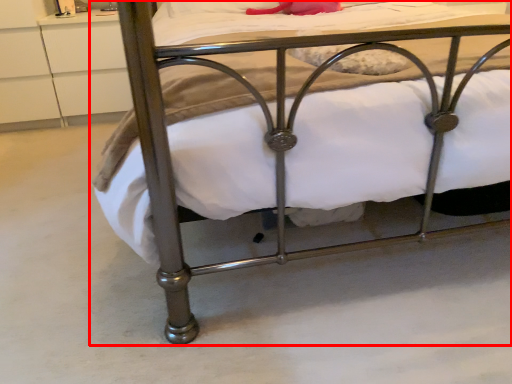
Question: From the image, what is the correct spatial relationship of bed (annotated by the red box) in relation to drawer?

Choices:
 (A) right
 (B) left

Answer: (A)